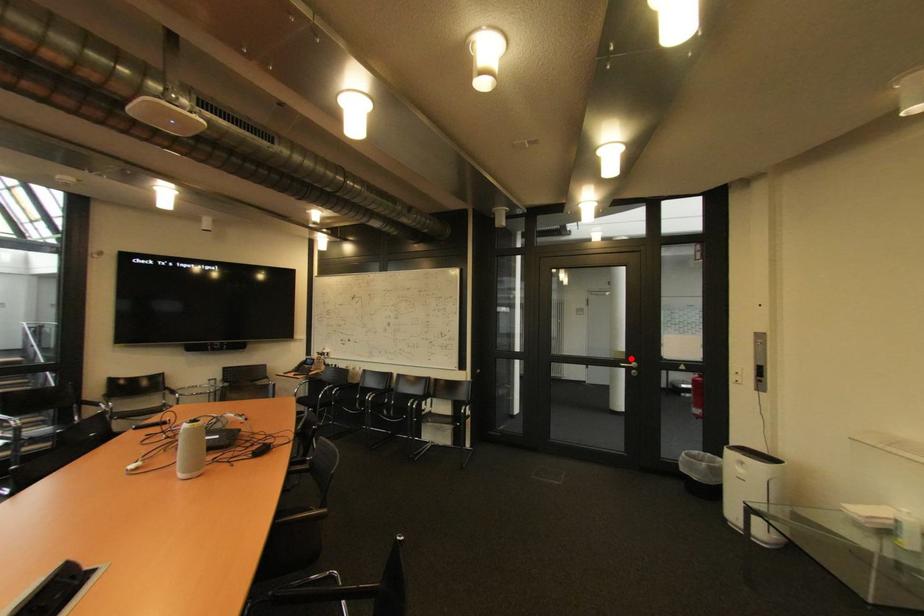
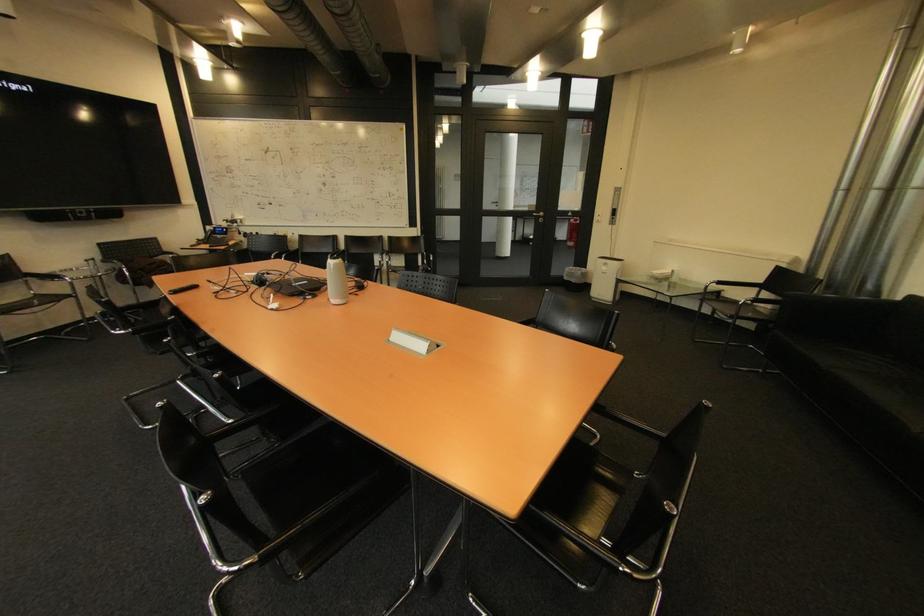
In the second image, find the point that corresponds to the highlighted location in the first image.

(542, 209)